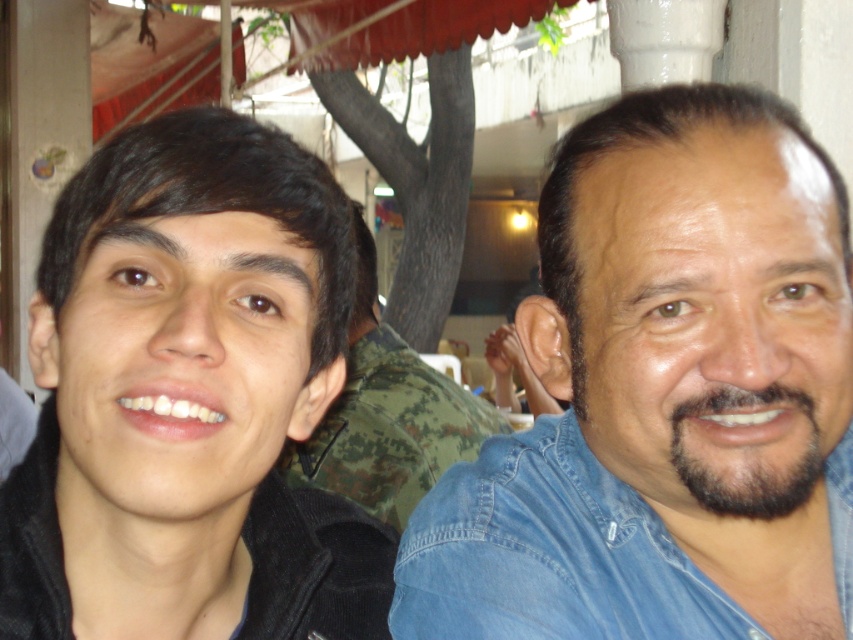
You are a photographer setting up for a group photo. You have two subjects wearing the blue denim shirt at right and the camouflage fabric shirt at center. To ensure both shirts are visible in the frame, which shirt should you adjust the camera angle to focus on first, considering their heights?

The blue denim shirt at right is shorter than the camouflage fabric shirt at center. Therefore, you should focus on the camouflage fabric shirt at center first to ensure its full visibility, then adjust for the shorter blue denim shirt at right.

You are a photographer standing in front of the two people in the image. You want to take a photo that focuses on the blue denim shirt at right and the black matte jacket at left. Which one will appear closer to you in the photo?

The blue denim shirt at right will appear closer to you in the photo because it is positioned further to the viewer than the black matte jacket at left.

Based on the photo, you are a photographer adjusting the framing of this image. The blue denim shirt at right and the black matte jacket at left must both be in focus. Given that your camera can only keep objects within 20 centimeters of each other in focus, will both subjects be sharp?

The distance between the blue denim shirt at right and black matte jacket at left is 20.73 centimeters. Since this exceeds the 20 centimeter limit, the camera cannot keep both in focus simultaneously.